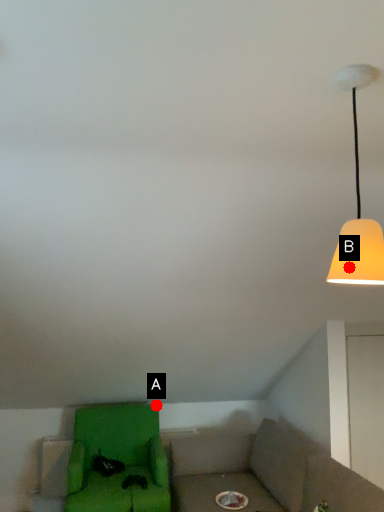
Question: Two points are circled on the image, labeled by A and B beside each circle. Which of the following is the farthest from the observer?

Choices:
 (A) A is further
 (B) B is further

Answer: (A)